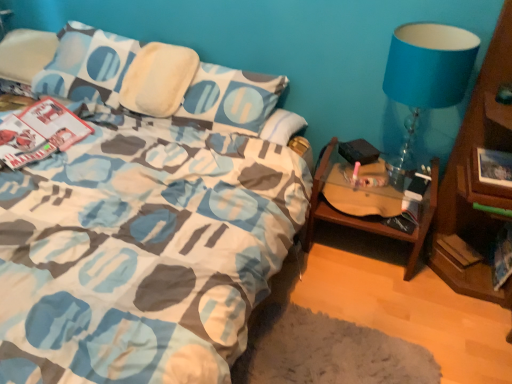
This screenshot has width=512, height=384. Find the location of `free space in front of woodenobject at right`. free space in front of woodenobject at right is located at coordinates (387, 295).